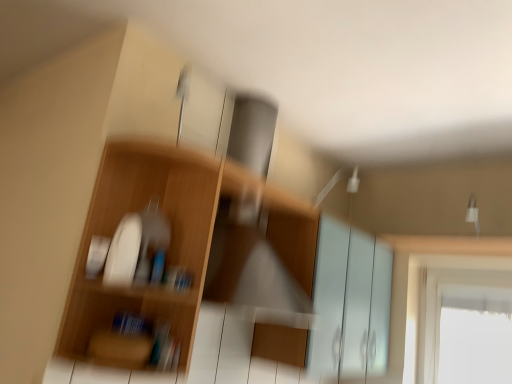
Question: Visually, is white glossy screen door at center positioned to the left or to the right of wooden shelf at left?

Choices:
 (A) left
 (B) right

Answer: (B)

Question: From a real-world perspective, is white glossy screen door at center above or below wooden shelf at left?

Choices:
 (A) below
 (B) above

Answer: (A)

Question: Considering their positions, is white glossy screen door at center located in front of or behind wooden shelf at left?

Choices:
 (A) front
 (B) behind

Answer: (B)

Question: Is wooden shelf at left situated inside white glossy screen door at center or outside?

Choices:
 (A) inside
 (B) outside

Answer: (B)

Question: Looking at their shapes, would you say wooden shelf at left is wider or thinner than white glossy screen door at center?

Choices:
 (A) thin
 (B) wide

Answer: (A)

Question: From a real-world perspective, is wooden shelf at left above or below white glossy screen door at center?

Choices:
 (A) below
 (B) above

Answer: (B)

Question: Based on their sizes in the image, would you say wooden shelf at left is bigger or smaller than white glossy screen door at center?

Choices:
 (A) small
 (B) big

Answer: (A)